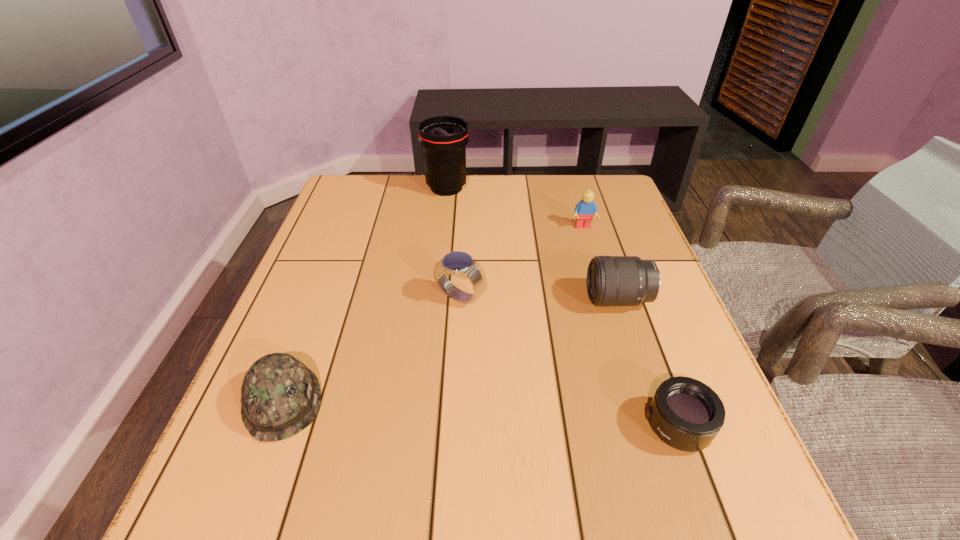
Identify the location of telephoto lens identified as the second closest to the second shortest telephoto lens. The width and height of the screenshot is (960, 540). (444, 138).